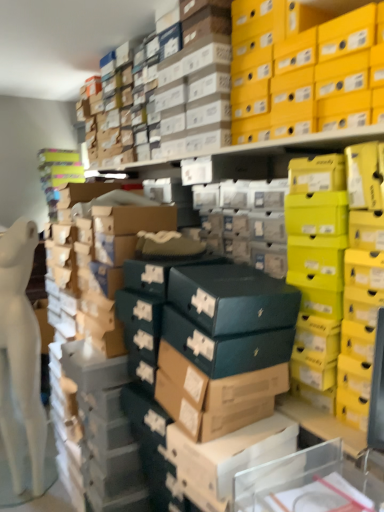
Describe the element at coordinates (306, 81) in the screenshot. I see `yellow matte shoebox at upper right` at that location.

Where is `yellow matte shoebox at upper right`? yellow matte shoebox at upper right is located at coordinates pos(306,81).

What do you see at coordinates (229, 454) in the screenshot?
I see `brown cardboard box at center` at bounding box center [229, 454].

Find the location of a particular element. brown cardboard box at center is located at coordinates (229, 454).

This screenshot has width=384, height=512. I want to click on yellow matte shoebox at upper right, so click(x=306, y=81).

Visually, is brown cardboard box at center positioned to the left or to the right of yellow matte shoebox at upper right?

brown cardboard box at center is to the left of yellow matte shoebox at upper right.

Considering the positions of objects brown cardboard box at center and yellow matte shoebox at upper right in the image provided, who is in front, brown cardboard box at center or yellow matte shoebox at upper right?

brown cardboard box at center.

Does point (239, 464) come behind point (250, 79)?

No, (239, 464) is closer to viewer.

From the image's perspective, which object appears higher, brown cardboard box at center or yellow matte shoebox at upper right?

yellow matte shoebox at upper right.

From a real-world perspective, is brown cardboard box at center on yellow matte shoebox at upper right?

No.

Which of these two, brown cardboard box at center or yellow matte shoebox at upper right, is wider?

brown cardboard box at center.

Does brown cardboard box at center have a lesser height compared to yellow matte shoebox at upper right?

No, brown cardboard box at center is not shorter than yellow matte shoebox at upper right.

Considering the sizes of objects brown cardboard box at center and yellow matte shoebox at upper right in the image provided, who is smaller, brown cardboard box at center or yellow matte shoebox at upper right?

Smaller between the two is brown cardboard box at center.

Choose the correct answer: Is brown cardboard box at center inside yellow matte shoebox at upper right or outside it?

Answer: brown cardboard box at center is spatially situated outside yellow matte shoebox at upper right.

Based on the photo, is brown cardboard box at center not close to yellow matte shoebox at upper right?

Indeed, brown cardboard box at center is not near yellow matte shoebox at upper right.

In the scene shown: Is brown cardboard box at center positioned with its back to yellow matte shoebox at upper right?

brown cardboard box at center does not have its back to yellow matte shoebox at upper right.

Image resolution: width=384 pixels, height=512 pixels. In order to click on cardboard box below the yellow matte shoebox at upper right (from the image's perspective) in this screenshot , I will do `click(229, 454)`.

Considering the positions of objects yellow matte shoebox at upper right and brown cardboard box at center in the image provided, who is more to the right, yellow matte shoebox at upper right or brown cardboard box at center?

Positioned to the right is yellow matte shoebox at upper right.

Is yellow matte shoebox at upper right closer to the viewer compared to brown cardboard box at center?

No, it is behind brown cardboard box at center.

Which is behind, point (245, 143) or point (287, 452)?

The point (245, 143) is more distant.

From the image's perspective, is yellow matte shoebox at upper right over brown cardboard box at center?

Correct, yellow matte shoebox at upper right appears higher than brown cardboard box at center in the image.

From a real-world perspective, is yellow matte shoebox at upper right positioned above or below brown cardboard box at center?

yellow matte shoebox at upper right is situated higher than brown cardboard box at center in the real world.

Based on the photo, considering the sizes of yellow matte shoebox at upper right and brown cardboard box at center in the image, is yellow matte shoebox at upper right wider or thinner than brown cardboard box at center?

In the image, yellow matte shoebox at upper right appears to be more narrow than brown cardboard box at center.

Does yellow matte shoebox at upper right have a greater height compared to brown cardboard box at center?

Incorrect, the height of yellow matte shoebox at upper right is not larger of that of brown cardboard box at center.

Considering the sizes of objects yellow matte shoebox at upper right and brown cardboard box at center in the image provided, who is bigger, yellow matte shoebox at upper right or brown cardboard box at center?

yellow matte shoebox at upper right is bigger.

Would you say yellow matte shoebox at upper right contains brown cardboard box at center?

Actually, brown cardboard box at center is outside yellow matte shoebox at upper right.

Does yellow matte shoebox at upper right touch brown cardboard box at center?

No, yellow matte shoebox at upper right is not making contact with brown cardboard box at center.

Is yellow matte shoebox at upper right oriented away from brown cardboard box at center?

yellow matte shoebox at upper right is not turned away from brown cardboard box at center.

Measure the distance from yellow matte shoebox at upper right to brown cardboard box at center.

yellow matte shoebox at upper right and brown cardboard box at center are 3.59 feet apart from each other.

At what (x,y) coordinates should I click in order to perform the action: click on cardboard box below the yellow matte shoebox at upper right (from the image's perspective). Please return your answer as a coordinate pair (x, y). The width and height of the screenshot is (384, 512). Looking at the image, I should click on (229, 454).

Locate an element on the screen. Image resolution: width=384 pixels, height=512 pixels. cardboard box below the yellow matte shoebox at upper right (from the image's perspective) is located at coordinates (229, 454).

You are a GUI agent. You are given a task and a screenshot of the screen. Output one action in this format:
    pyautogui.click(x=<x>, y=<y>)
    Task: Click on the cardboard box in front of the yellow matte shoebox at upper right
    
    Given the screenshot: What is the action you would take?
    pyautogui.click(x=229, y=454)